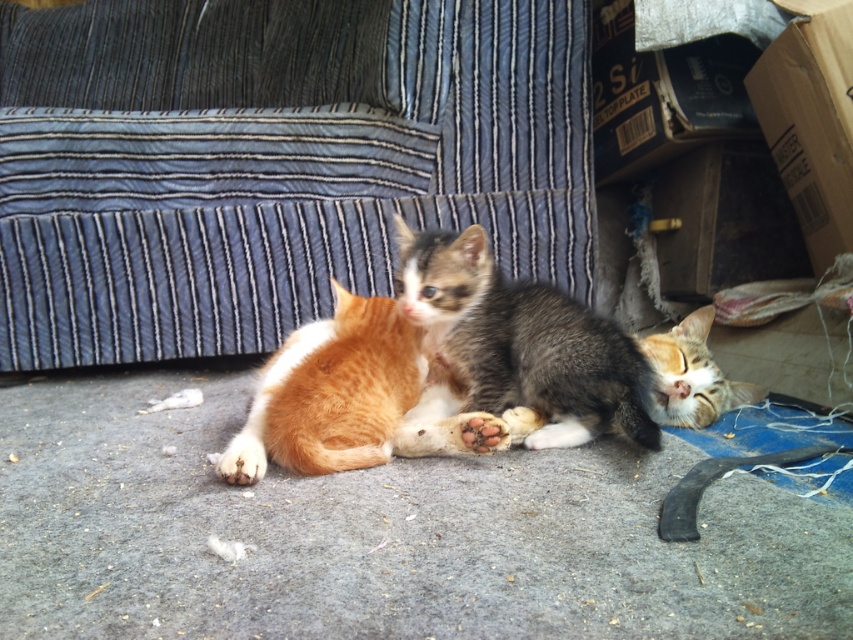
Question: Does blue striped fabric couch at upper center have a larger size compared to gray-furred kitten at center?

Choices:
 (A) no
 (B) yes

Answer: (B)

Question: Is gray-furred kitten at center below orange fur cat at center?

Choices:
 (A) yes
 (B) no

Answer: (B)

Question: Is blue striped fabric couch at upper center positioned before tabby fur cat at lower right?

Choices:
 (A) no
 (B) yes

Answer: (A)

Question: Which object is positioned farthest from the gray-furred kitten at center?

Choices:
 (A) blue striped fabric couch at upper center
 (B) orange fur cat at center
 (C) tabby fur cat at lower right

Answer: (A)

Question: Among these points, which one is nearest to the camera?

Choices:
 (A) (260, 397)
 (B) (675, 330)
 (C) (489, 356)
 (D) (303, 100)

Answer: (A)

Question: Based on their relative distances, which object is nearer to the orange fur cat at center?

Choices:
 (A) gray-furred kitten at center
 (B) tabby fur cat at lower right

Answer: (A)